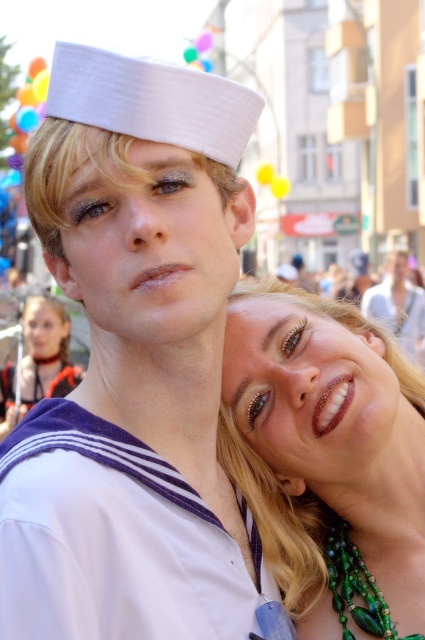
Question: Which point is closer to the camera?

Choices:
 (A) (53, 330)
 (B) (393, 332)
 (C) (399, 381)

Answer: (C)

Question: Can you confirm if green beaded necklace at upper right is positioned to the left of matte white sailor hat at upper center?

Choices:
 (A) no
 (B) yes

Answer: (B)

Question: Among these objects, which one is farthest from the camera?

Choices:
 (A) green beaded necklace at lower right
 (B) matte white sailor hat at upper center
 (C) green beaded necklace at upper right

Answer: (B)

Question: Which of the following is the farthest from the observer?

Choices:
 (A) matte white sailor hat at upper center
 (B) green beaded necklace at lower right
 (C) matte black hair at upper left

Answer: (A)

Question: Is green beaded necklace at upper right to the left of matte white sailor hat at upper center from the viewer's perspective?

Choices:
 (A) yes
 (B) no

Answer: (A)

Question: Does green beaded necklace at upper right have a greater width compared to green beaded necklace at lower right?

Choices:
 (A) yes
 (B) no

Answer: (A)